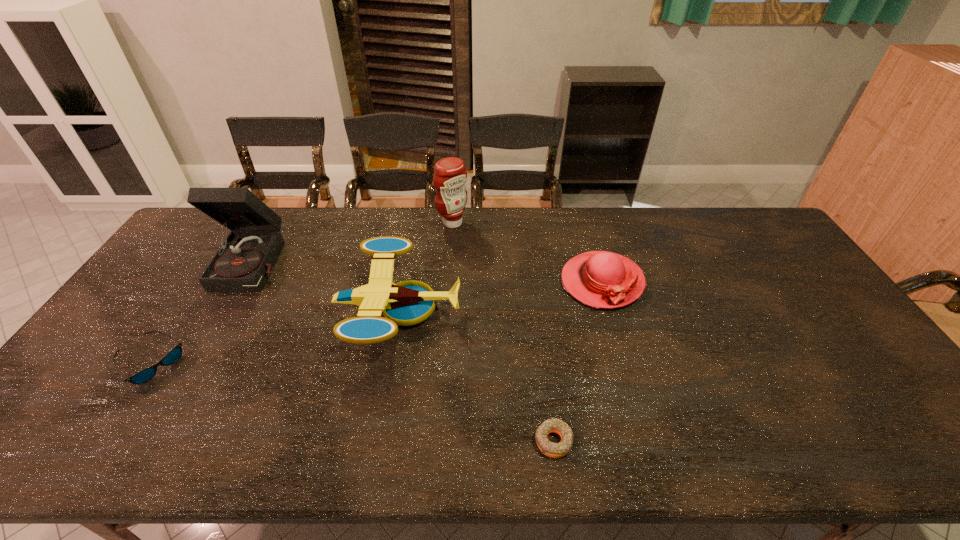
This screenshot has width=960, height=540. Identify the location of phonograph_record. (243, 262).

Identify the location of the farthest object. The width and height of the screenshot is (960, 540). (450, 174).

Where is `drone`? This screenshot has width=960, height=540. drone is located at coordinates (406, 303).

The height and width of the screenshot is (540, 960). Identify the location of the third shortest object. (601, 279).

Identify the location of the rightmost object. This screenshot has height=540, width=960. (601, 279).

Where is `the second shortest object`? This screenshot has width=960, height=540. the second shortest object is located at coordinates (170, 358).

This screenshot has width=960, height=540. What are the coordinates of `doughnut` in the screenshot? It's located at (555, 450).

The width and height of the screenshot is (960, 540). Identify the location of the fifth object from left to right. (555, 450).

Locate an element on the screen. vacant space located on the front-facing side of the phonograph_record is located at coordinates (201, 362).

Find the location of a particular element. The height and width of the screenshot is (540, 960). vacant space located 0.080m on the right of the condiment is located at coordinates (490, 223).